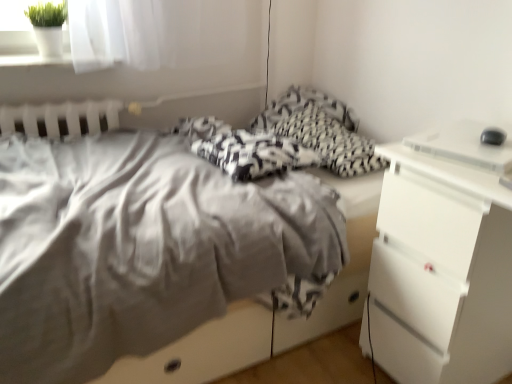
Describe the element at coordinates (441, 272) in the screenshot. I see `white plastic chest of drawers at right` at that location.

Identify the location of white plastic chest of drawers at right. Image resolution: width=512 pixels, height=384 pixels. (441, 272).

Considering the relative sizes of white plastic desktop at right and white plastic chest of drawers at right in the image provided, is white plastic desktop at right smaller than white plastic chest of drawers at right?

Indeed, white plastic desktop at right has a smaller size compared to white plastic chest of drawers at right.

In the scene shown: How much distance is there between white plastic desktop at right and white plastic chest of drawers at right?

white plastic desktop at right and white plastic chest of drawers at right are 12.30 inches apart.

Are white plastic desktop at right and white plastic chest of drawers at right beside each other?

No, white plastic desktop at right is not touching white plastic chest of drawers at right.

In the scene shown: From the image's perspective, is white plastic desktop at right on white plastic chest of drawers at right?

Yes.

From a real-world perspective, which is physically below, white plastic desktop at right or matte gray bed at center?

In real-world perspective, matte gray bed at center is lower.

Considering the sizes of white plastic desktop at right and matte gray bed at center in the image, is white plastic desktop at right taller or shorter than matte gray bed at center?

In the image, white plastic desktop at right appears to be shorter than matte gray bed at center.

Is white plastic desktop at right closer to camera compared to matte gray bed at center?

No.

From the picture: Considering the positions of objects matte gray bed at center and white plastic desktop at right in the image provided, who is more to the right, matte gray bed at center or white plastic desktop at right?

From the viewer's perspective, white plastic desktop at right appears more on the right side.

Is the depth of matte gray bed at center greater than that of white plastic desktop at right?

No, matte gray bed at center is closer to the viewer.

Is point (20, 309) less distant than point (435, 150)?

Yes, point (20, 309) is closer to viewer.

Is matte gray bed at center behind white plastic chest of drawers at right?

No, matte gray bed at center is closer to the viewer.

Does matte gray bed at center have a smaller size compared to white plastic chest of drawers at right?

No, matte gray bed at center is not smaller than white plastic chest of drawers at right.

Could you tell me if matte gray bed at center is turned towards white plastic chest of drawers at right?

No.

From a real-world perspective, which object rests below the other?

From a 3D spatial view, white plastic chest of drawers at right is below.

Does white plastic chest of drawers at right appear on the left side of white plastic desktop at right?

Incorrect, white plastic chest of drawers at right is not on the left side of white plastic desktop at right.

Which of these two, white plastic chest of drawers at right or white plastic desktop at right, is smaller?

Smaller between the two is white plastic desktop at right.

Could you tell me if white plastic chest of drawers at right is turned towards white plastic desktop at right?

No, white plastic chest of drawers at right is not aimed at white plastic desktop at right.

Which object is closer to the camera taking this photo, white plastic chest of drawers at right or matte gray bed at center?

Positioned in front is matte gray bed at center.

Is white plastic chest of drawers at right far from matte gray bed at center?

Actually, white plastic chest of drawers at right and matte gray bed at center are a little close together.

Considering the sizes of white plastic chest of drawers at right and matte gray bed at center in the image, is white plastic chest of drawers at right bigger or smaller than matte gray bed at center?

Clearly, white plastic chest of drawers at right is smaller in size than matte gray bed at center.

Would you say white plastic chest of drawers at right is outside matte gray bed at center?

Yes, white plastic chest of drawers at right is located beyond the bounds of matte gray bed at center.

You are a GUI agent. You are given a task and a screenshot of the screen. Output one action in this format:
    pyautogui.click(x=<x>, y=<y>)
    Task: Click on the chest of drawers beneath the white plastic desktop at right (from a real-world perspective)
    The width and height of the screenshot is (512, 384).
    Given the screenshot: What is the action you would take?
    pyautogui.click(x=441, y=272)

You are a GUI agent. You are given a task and a screenshot of the screen. Output one action in this format:
    pyautogui.click(x=<x>, y=<y>)
    Task: Click on the desktop above the matte gray bed at center (from a real-world perspective)
    This screenshot has width=512, height=384.
    Given the screenshot: What is the action you would take?
    (465, 145)

Based on their spatial positions, is white plastic chest of drawers at right or white plastic desktop at right closer to matte gray bed at center?

The object closer to matte gray bed at center is white plastic chest of drawers at right.

Which object lies nearer to the anchor point white plastic desktop at right, white plastic chest of drawers at right or matte gray bed at center?

white plastic chest of drawers at right is positioned closer to the anchor white plastic desktop at right.

From the image, which object appears to be farther from white plastic desktop at right, matte gray bed at center or white plastic chest of drawers at right?

Based on the image, matte gray bed at center appears to be further to white plastic desktop at right.

Based on their spatial positions, is white plastic desktop at right or white plastic chest of drawers at right further from matte gray bed at center?

white plastic desktop at right lies further to matte gray bed at center than the other object.

When comparing their distances from white plastic chest of drawers at right, does matte gray bed at center or white plastic desktop at right seem further?

The object further to white plastic chest of drawers at right is matte gray bed at center.

Which object lies further to the anchor point white plastic chest of drawers at right, white plastic desktop at right or matte gray bed at center?

matte gray bed at center lies further to white plastic chest of drawers at right than the other object.

You are a GUI agent. You are given a task and a screenshot of the screen. Output one action in this format:
    pyautogui.click(x=<x>, y=<y>)
    Task: Click on the desktop between matte gray bed at center and white plastic chest of drawers at right
    Image resolution: width=512 pixels, height=384 pixels.
    Given the screenshot: What is the action you would take?
    pyautogui.click(x=465, y=145)